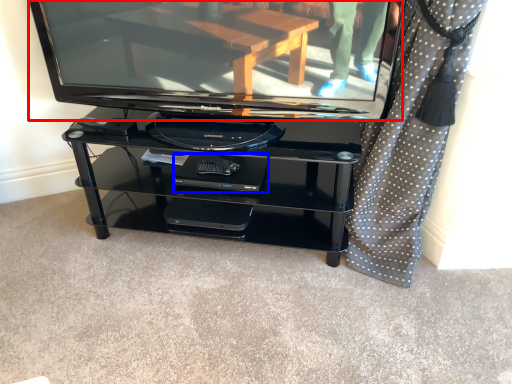
Question: Which of the following is the closest to the observer, television (highlighted by a red box) or footrest (highlighted by a blue box)?

Choices:
 (A) television
 (B) footrest

Answer: (A)